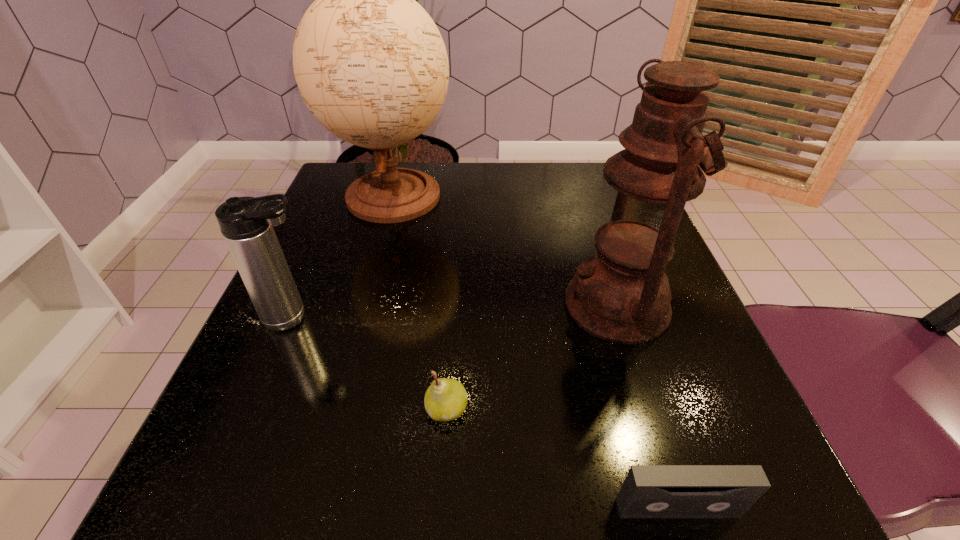
The width and height of the screenshot is (960, 540). Find the location of `blank area at the left edge`. blank area at the left edge is located at coordinates (356, 323).

Image resolution: width=960 pixels, height=540 pixels. Find the location of `free space at the right edge of the desktop`. free space at the right edge of the desktop is located at coordinates (x=703, y=392).

Where is `free space at the far left corner of the desktop`? free space at the far left corner of the desktop is located at coordinates (335, 183).

The height and width of the screenshot is (540, 960). I want to click on vacant region at the near left corner of the desktop, so click(x=266, y=445).

Find the location of a particular element. This screenshot has width=960, height=540. vacant space at the far right corner of the desktop is located at coordinates (568, 179).

Locate an element on the screen. vacant space at the near right corner of the desktop is located at coordinates (716, 462).

In order to click on vacant space that is in between the farthest object and the videotape in this screenshot , I will do `click(536, 352)`.

At what (x,y) coordinates should I click in order to perform the action: click on free point between the nearest object and the tallest object. Please return your answer as a coordinate pair (x, y). Looking at the image, I should click on pos(536,352).

At what (x,y) coordinates should I click in order to perform the action: click on empty location between the oil lamp and the thermos bottle. Please return your answer as a coordinate pair (x, y). The height and width of the screenshot is (540, 960). Looking at the image, I should click on (456, 312).

Locate an element on the screen. vacant space in between the thermos bottle and the oil lamp is located at coordinates (456, 312).